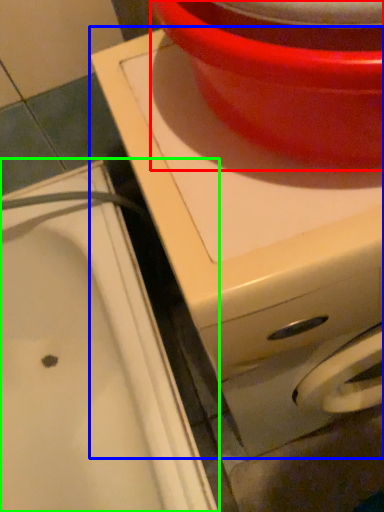
Question: Which is farther away from basin (highlighted by a red box)? appliance (highlighted by a blue box) or sink (highlighted by a green box)?

Choices:
 (A) appliance
 (B) sink

Answer: (B)